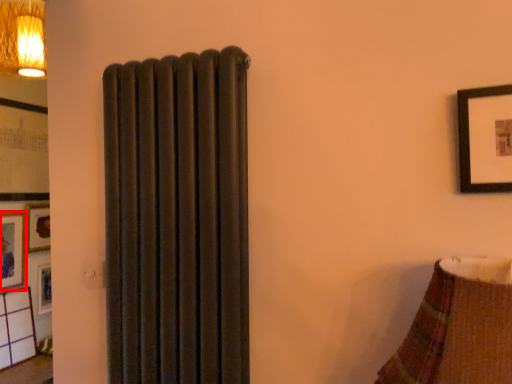
Question: Where is picture frame (annotated by the red box) located in relation to picture frame in the image?

Choices:
 (A) left
 (B) right

Answer: (A)